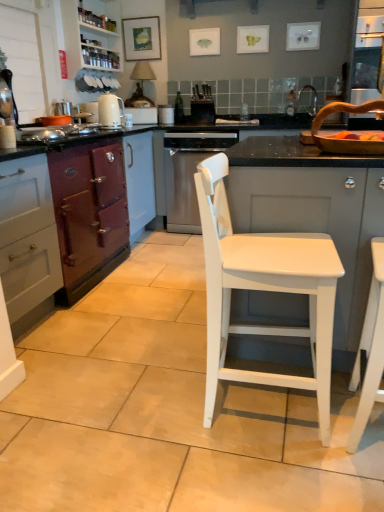
Find the location of a particular element. The image size is (384, 512). white glossy chair at center, acting as the 1th chair starting from the left is located at coordinates (263, 290).

The height and width of the screenshot is (512, 384). What do you see at coordinates (76, 220) in the screenshot?
I see `matte burgundy wood stove at left, placed as the second cabinetry when sorted from left to right` at bounding box center [76, 220].

Where is `matte burgundy wood stove at left, marked as the third cabinetry in a right-to-left arrangement`? This screenshot has width=384, height=512. matte burgundy wood stove at left, marked as the third cabinetry in a right-to-left arrangement is located at coordinates (76, 220).

What do you see at coordinates (202, 111) in the screenshot? I see `black matte oven at center, which is the first appliance in right-to-left order` at bounding box center [202, 111].

What do you see at coordinates (143, 115) in the screenshot? The image size is (384, 512). I see `white ceramic toaster at upper center, the first appliance when ordered from left to right` at bounding box center [143, 115].

Measure the distance between white matte cabinet at center, the 1th cabinetry viewed from the right, and camera.

The depth of white matte cabinet at center, the 1th cabinetry viewed from the right, is 1.45 meters.

Identify the location of white glossy chair at center, the second chair when ordered from right to left. This screenshot has width=384, height=512. (263, 290).

Consider the image. Which is more to the right, white glossy electric kettle at center-left or metallic silver faucet at upper right?

metallic silver faucet at upper right.

Is white glossy electric kettle at center-left next to metallic silver faucet at upper right?

No, white glossy electric kettle at center-left is not touching metallic silver faucet at upper right.

Is white glossy electric kettle at center-left shorter than metallic silver faucet at upper right?

No.

From a real-world perspective, between white glossy electric kettle at center-left and metallic silver faucet at upper right, who is vertically lower?

In real-world perspective, white glossy electric kettle at center-left is lower.

From a real-world perspective, does white matte chair at right, arranged as the 2th chair when viewed from the left, sit lower than purple matte oven at left, marked as the fourth cabinetry in a right-to-left arrangement?

Yes.

From the picture: Which is closer, (x=367, y=303) or (x=17, y=287)?

The point (x=367, y=303) is in front.

Is white matte chair at right, arranged as the 2th chair when viewed from the left, not inside purple matte oven at left, marked as the fourth cabinetry in a right-to-left arrangement?

white matte chair at right, arranged as the 2th chair when viewed from the left, lies outside purple matte oven at left, marked as the fourth cabinetry in a right-to-left arrangement,'s area.

How far apart are white matte chair at right, arranged as the 2th chair when viewed from the left, and purple matte oven at left, marked as the fourth cabinetry in a right-to-left arrangement?

white matte chair at right, arranged as the 2th chair when viewed from the left, is 4.99 feet away from purple matte oven at left, marked as the fourth cabinetry in a right-to-left arrangement.

Image resolution: width=384 pixels, height=512 pixels. What are the coordinates of `the 1st cabinetry located above the white glossy chair at center, acting as the 1th chair starting from the left (from a real-world perspective)` in the screenshot? It's located at (27, 239).

Is white glossy chair at center, acting as the 1th chair starting from the left, facing away from purple matte oven at left, which appears as the first cabinetry when viewed from the left?

Correct, white glossy chair at center, acting as the 1th chair starting from the left, is looking away from purple matte oven at left, which appears as the first cabinetry when viewed from the left.

Is white glossy chair at center, the second chair when ordered from right to left, shorter than purple matte oven at left, which appears as the first cabinetry when viewed from the left?

Indeed, white glossy chair at center, the second chair when ordered from right to left, has a lesser height compared to purple matte oven at left, which appears as the first cabinetry when viewed from the left.

From a real-world perspective, is matte burgundy wood stove at left, placed as the second cabinetry when sorted from left to right, on purple matte oven at left, marked as the fourth cabinetry in a right-to-left arrangement?

Indeed, from a real-world perspective, matte burgundy wood stove at left, placed as the second cabinetry when sorted from left to right, stands above purple matte oven at left, marked as the fourth cabinetry in a right-to-left arrangement.

Is matte burgundy wood stove at left, marked as the third cabinetry in a right-to-left arrangement, positioned far away from purple matte oven at left, marked as the fourth cabinetry in a right-to-left arrangement?

They are positioned close to each other.

Is matte burgundy wood stove at left, placed as the second cabinetry when sorted from left to right, looking in the opposite direction of purple matte oven at left, which appears as the first cabinetry when viewed from the left?

No, purple matte oven at left, which appears as the first cabinetry when viewed from the left, is not at the back of matte burgundy wood stove at left, placed as the second cabinetry when sorted from left to right.

How different are the orientations of satin silver dishwasher at center and white wood cabinet at upper left, placed as the 2th cabinetry when sorted from right to left, in degrees?

satin silver dishwasher at center and white wood cabinet at upper left, placed as the 2th cabinetry when sorted from right to left, are facing 87.3 degrees away from each other.

Is satin silver dishwasher at center shorter than white wood cabinet at upper left, placed as the 2th cabinetry when sorted from right to left?

Incorrect, the height of satin silver dishwasher at center does not fall short of that of white wood cabinet at upper left, placed as the 2th cabinetry when sorted from right to left.

Is satin silver dishwasher at center situated inside white wood cabinet at upper left, the third cabinetry when ordered from left to right, or outside?

satin silver dishwasher at center is not enclosed by white wood cabinet at upper left, the third cabinetry when ordered from left to right.

Is point (171, 132) less distant than point (107, 63)?

Yes, point (171, 132) is in front of point (107, 63).

Which is less distant, [102,63] or [2,204]?

Point [102,63] is farther from the camera than point [2,204].

Is white wood cabinet at upper left, placed as the 2th cabinetry when sorted from right to left, in front of or behind matte burgundy wood stove at left, placed as the second cabinetry when sorted from left to right, in the image?

white wood cabinet at upper left, placed as the 2th cabinetry when sorted from right to left, is behind matte burgundy wood stove at left, placed as the second cabinetry when sorted from left to right.

Does white wood cabinet at upper left, the third cabinetry when ordered from left to right, have a greater width compared to matte burgundy wood stove at left, placed as the second cabinetry when sorted from left to right?

No.

Is point (154, 34) more distant than point (165, 122)?

Yes, point (154, 34) is farther from viewer.

Which of these two, matte wooden picture frame at upper center or white glossy toaster at center, which is counted as the 2th appliance, starting from the right, is thinner?

matte wooden picture frame at upper center.

Considering the positions of objects matte wooden picture frame at upper center and white glossy toaster at center, which is the 2th appliance in left-to-right order, in the image provided, who is behind, matte wooden picture frame at upper center or white glossy toaster at center, which is the 2th appliance in left-to-right order,?

Positioned behind is matte wooden picture frame at upper center.

Choose the correct answer: Is matte wooden picture frame at upper center inside white glossy toaster at center, which is counted as the 2th appliance, starting from the right, or outside it?

matte wooden picture frame at upper center lies outside white glossy toaster at center, which is counted as the 2th appliance, starting from the right.

Identify the location of faucet on the right of white glossy electric kettle at center-left. (307, 100).

There is a white matte chair at right, arranged as the 2th chair when viewed from the left. Where is `the 2nd cabinetry above it (from the image's perspective)`? Image resolution: width=384 pixels, height=512 pixels. the 2nd cabinetry above it (from the image's perspective) is located at coordinates (27, 239).

When comparing their distances from white wood cabinet at upper left, placed as the 2th cabinetry when sorted from right to left, does white glossy chair at center, the second chair when ordered from right to left, or white ceramic sink at upper right seem closer?

Based on the image, white ceramic sink at upper right appears to be nearer to white wood cabinet at upper left, placed as the 2th cabinetry when sorted from right to left.

Considering their positions, is white glossy toaster at center, which is counted as the 2th appliance, starting from the right, positioned closer to matte burgundy wood stove at left, placed as the second cabinetry when sorted from left to right, than purple matte oven at left, marked as the fourth cabinetry in a right-to-left arrangement?

purple matte oven at left, marked as the fourth cabinetry in a right-to-left arrangement, is closer to matte burgundy wood stove at left, placed as the second cabinetry when sorted from left to right.

When comparing their distances from white matte chair at right, the first chair in the right-to-left sequence, does white matte cabinet at center, placed as the fourth cabinetry when sorted from left to right, or white glossy toaster at center, which is counted as the 2th appliance, starting from the right, seem further?

white glossy toaster at center, which is counted as the 2th appliance, starting from the right, is further to white matte chair at right, the first chair in the right-to-left sequence.

When comparing their distances from matte wooden picture frame at upper center, does white glossy toaster at center, which is counted as the 2th appliance, starting from the right, or purple matte oven at left, marked as the fourth cabinetry in a right-to-left arrangement, seem closer?

white glossy toaster at center, which is counted as the 2th appliance, starting from the right, is positioned closer to the anchor matte wooden picture frame at upper center.

Looking at the image, which one is located closer to black matte oven at center, which is counted as the third appliance, starting from the left, white glossy chair at center, acting as the 1th chair starting from the left, or satin silver dishwasher at center?

satin silver dishwasher at center is positioned closer to the anchor black matte oven at center, which is counted as the third appliance, starting from the left.

Looking at the image, which one is located further to black matte oven at center, which is counted as the third appliance, starting from the left, matte burgundy wood stove at left, placed as the second cabinetry when sorted from left to right, or white matte chair at right, arranged as the 2th chair when viewed from the left?

white matte chair at right, arranged as the 2th chair when viewed from the left, lies further to black matte oven at center, which is counted as the third appliance, starting from the left, than the other object.

Looking at the image, which one is located closer to black matte oven at center, which is the first appliance in right-to-left order, white matte cabinet at center, placed as the fourth cabinetry when sorted from left to right, or white glossy electric kettle at center-left?

Based on the image, white glossy electric kettle at center-left appears to be nearer to black matte oven at center, which is the first appliance in right-to-left order.

Based on their spatial positions, is matte wooden picture frame at upper center or white glossy chair at center, acting as the 1th chair starting from the left, closer to white glossy electric kettle at center-left?

matte wooden picture frame at upper center is positioned closer to the anchor white glossy electric kettle at center-left.

Identify the location of cabinetry between matte wooden picture frame at upper center and matte burgundy wood stove at left, marked as the third cabinetry in a right-to-left arrangement, in the up-down direction. The width and height of the screenshot is (384, 512). (89, 40).

You are a GUI agent. You are given a task and a screenshot of the screen. Output one action in this format:
    pyautogui.click(x=<x>, y=<y>)
    Task: Click on the faucet between white glossy chair at center, the second chair when ordered from right to left, and white glossy toaster at center, which is the 2th appliance in left-to-right order, along the z-axis
    This screenshot has width=384, height=512.
    Given the screenshot: What is the action you would take?
    pyautogui.click(x=307, y=100)

Locate an element on the screen. The width and height of the screenshot is (384, 512). chair between matte burgundy wood stove at left, marked as the third cabinetry in a right-to-left arrangement, and white matte chair at right, arranged as the 2th chair when viewed from the left, from left to right is located at coordinates (263, 290).

At what (x,y) coordinates should I click in order to perform the action: click on home appliance located between white ceramic sink at upper right and white glossy toaster at center, which is the 2th appliance in left-to-right order, in the depth direction. Please return your answer as a coordinate pair (x, y). This screenshot has width=384, height=512. Looking at the image, I should click on coord(188,174).